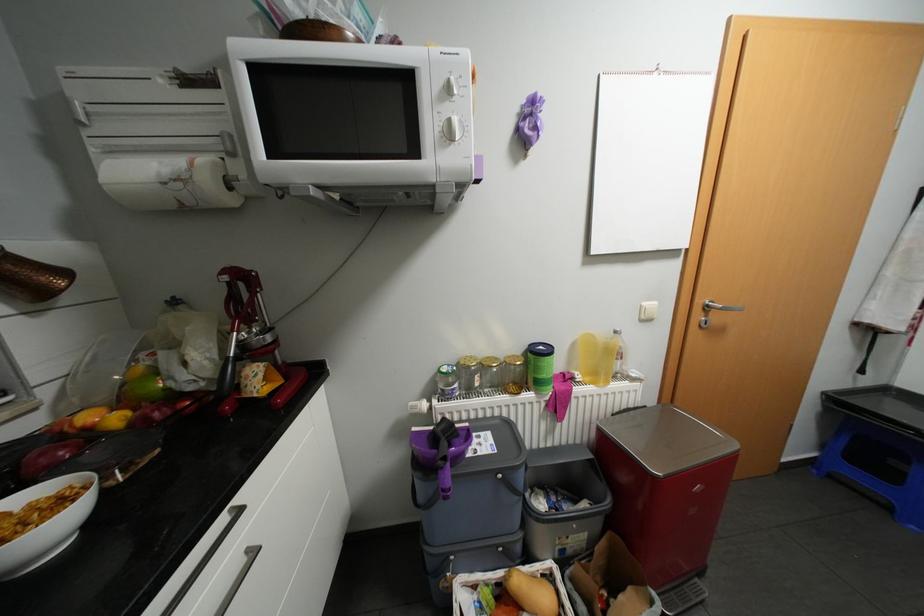
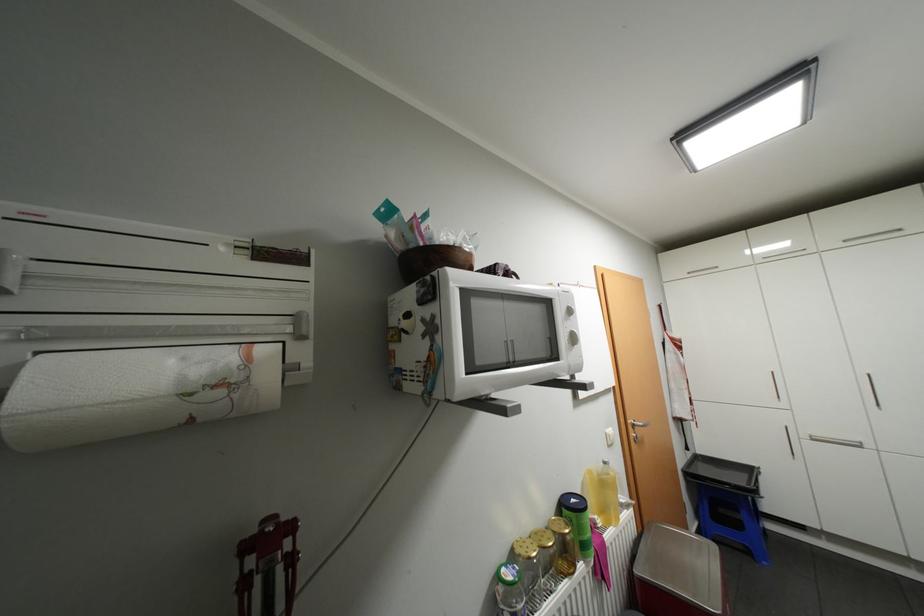
The point at (544, 368) is marked in the first image. Where is the corresponding point in the second image?

(589, 528)